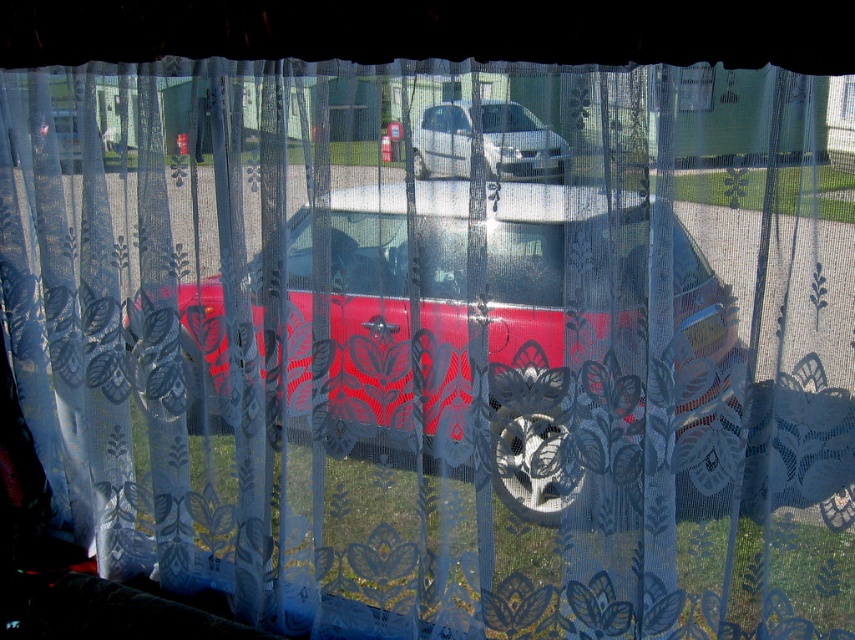
Question: Which point appears farthest from the camera in this image?

Choices:
 (A) (487, 241)
 (B) (443, 129)

Answer: (B)

Question: Is shiny metallic car at center above silver metallic van at center?

Choices:
 (A) yes
 (B) no

Answer: (B)

Question: Which point is closer to the camera?

Choices:
 (A) (488, 129)
 (B) (458, 288)

Answer: (A)

Question: Does shiny metallic car at center have a larger size compared to silver metallic van at center?

Choices:
 (A) no
 (B) yes

Answer: (B)

Question: Which point is farther to the camera?

Choices:
 (A) silver metallic van at center
 (B) shiny metallic car at center

Answer: (A)

Question: Can you confirm if shiny metallic car at center is thinner than silver metallic van at center?

Choices:
 (A) yes
 (B) no

Answer: (B)